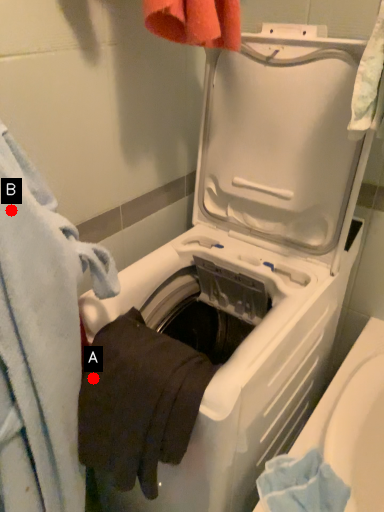
Question: Two points are circled on the image, labeled by A and B beside each circle. Among these points, which one is nearest to the camera?

Choices:
 (A) A is closer
 (B) B is closer

Answer: (B)